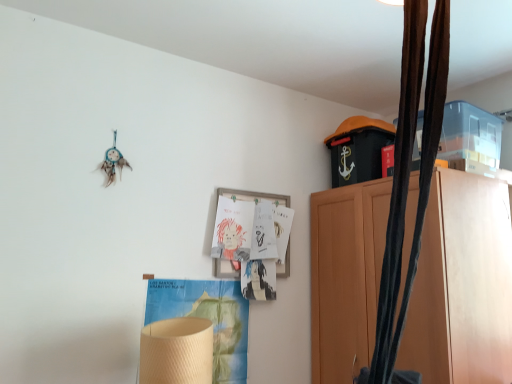
What do you see at coordinates (254, 195) in the screenshot? This screenshot has width=512, height=384. I see `wooden picture frame at center` at bounding box center [254, 195].

Identify the location of wooden picture frame at center. This screenshot has height=384, width=512. (254, 195).

This screenshot has width=512, height=384. Describe the element at coordinates (462, 284) in the screenshot. I see `wooden cabinet at upper right` at that location.

At what (x,y) coordinates should I click in order to perform the action: click on wooden cabinet at upper right. Please return your answer as a coordinate pair (x, y). The height and width of the screenshot is (384, 512). Looking at the image, I should click on (462, 284).

Where is `wooden picture frame at center`? The height and width of the screenshot is (384, 512). wooden picture frame at center is located at coordinates (254, 195).

In the image, is wooden cabinet at upper right on the left side or the right side of wooden picture frame at center?

From the image, it's evident that wooden cabinet at upper right is to the right of wooden picture frame at center.

Between wooden cabinet at upper right and wooden picture frame at center, which one is positioned in front?

wooden cabinet at upper right.

Considering the points (471, 274) and (218, 267), which point is in front, point (471, 274) or point (218, 267)?

The point (471, 274) is closer to the camera.

From the image's perspective, is wooden cabinet at upper right on top of wooden picture frame at center?

Incorrect, from the image's perspective, wooden cabinet at upper right is lower than wooden picture frame at center.

Looking at this image, from a real-world perspective, is wooden cabinet at upper right positioned under wooden picture frame at center based on gravity?

Yes, from a real-world perspective, wooden cabinet at upper right is beneath wooden picture frame at center.

In terms of width, does wooden cabinet at upper right look wider or thinner when compared to wooden picture frame at center?

Considering their sizes, wooden cabinet at upper right looks broader than wooden picture frame at center.

Which of these two, wooden cabinet at upper right or wooden picture frame at center, stands taller?

wooden cabinet at upper right.

Between wooden cabinet at upper right and wooden picture frame at center, which one has smaller size?

Smaller between the two is wooden picture frame at center.

Is wooden picture frame at center located within wooden cabinet at upper right?

No, wooden picture frame at center is not surrounded by wooden cabinet at upper right.

Are wooden cabinet at upper right and wooden picture frame at center located far from each other?

No, wooden cabinet at upper right is in close proximity to wooden picture frame at center.

Does wooden cabinet at upper right turn towards wooden picture frame at center?

Yes, wooden cabinet at upper right is facing wooden picture frame at center.

From the picture: Measure the distance from wooden cabinet at upper right to wooden picture frame at center.

The distance of wooden cabinet at upper right from wooden picture frame at center is 28.75 inches.

The image size is (512, 384). I want to click on cabinetry below the wooden picture frame at center (from the image's perspective), so click(462, 284).

Is wooden picture frame at center to the left or to the right of wooden cabinet at upper right in the image?

Clearly, wooden picture frame at center is on the left of wooden cabinet at upper right in the image.

Is wooden picture frame at center closer to the viewer compared to wooden cabinet at upper right?

No, wooden picture frame at center is further to the viewer.

Is point (283, 269) positioned before point (350, 219)?

No, (283, 269) is further to viewer.

From the image's perspective, which one is positioned lower, wooden picture frame at center or wooden cabinet at upper right?

From the image's view, wooden cabinet at upper right is below.

From a real-world perspective, is wooden picture frame at center beneath wooden cabinet at upper right?

No, from a real-world perspective, wooden picture frame at center is not below wooden cabinet at upper right.

Based on the photo, in terms of width, does wooden picture frame at center look wider or thinner when compared to wooden cabinet at upper right?

In the image, wooden picture frame at center appears to be more narrow than wooden cabinet at upper right.

Who is shorter, wooden picture frame at center or wooden cabinet at upper right?

With less height is wooden picture frame at center.

Who is bigger, wooden picture frame at center or wooden cabinet at upper right?

Bigger between the two is wooden cabinet at upper right.

Would you say wooden picture frame at center contains wooden cabinet at upper right?

No.

Is wooden picture frame at center positioned far away from wooden cabinet at upper right?

No, wooden picture frame at center is not far from wooden cabinet at upper right.

Is wooden picture frame at center positioned with its back to wooden cabinet at upper right?

That's not correct — wooden picture frame at center is not looking away from wooden cabinet at upper right.

How different are the orientations of wooden picture frame at center and wooden cabinet at upper right in degrees?

The angular difference between wooden picture frame at center and wooden cabinet at upper right is 92.2 degrees.

There is a wooden cabinet at upper right. At what (x,y) coordinates should I click in order to perform the action: click on picture frame above it (from a real-world perspective). Please return your answer as a coordinate pair (x, y). Image resolution: width=512 pixels, height=384 pixels. Looking at the image, I should click on (254, 195).

You are a GUI agent. You are given a task and a screenshot of the screen. Output one action in this format:
    pyautogui.click(x=<x>, y=<y>)
    Task: Click on the cabinetry that appears below the wooden picture frame at center (from a real-world perspective)
    This screenshot has height=384, width=512.
    Given the screenshot: What is the action you would take?
    pyautogui.click(x=462, y=284)

The width and height of the screenshot is (512, 384). In order to click on picture frame located on the left of wooden cabinet at upper right in this screenshot , I will do `click(254, 195)`.